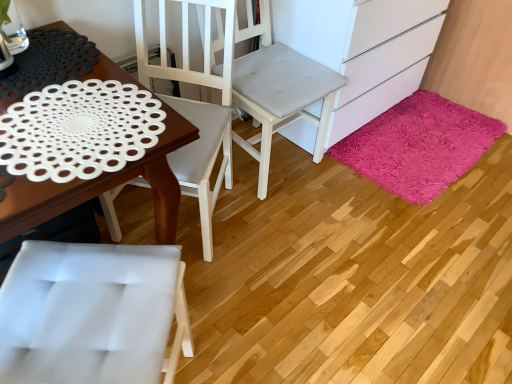
Where is `white matte cabinet at lower right`? The width and height of the screenshot is (512, 384). white matte cabinet at lower right is located at coordinates tap(362, 49).

You are a GUI agent. You are given a task and a screenshot of the screen. Output one action in this format:
    pyautogui.click(x=<x>, y=<y>)
    Task: Click on the white fabric chair at center, the second chair when ordered from left to right
    
    Given the screenshot: What is the action you would take?
    pyautogui.click(x=278, y=90)

Image resolution: width=512 pixels, height=384 pixels. What do you see at coordinates (103, 188) in the screenshot?
I see `white matte doily at left` at bounding box center [103, 188].

Where is `white matte chair at center, placed as the 2th chair when sorted from right to left`? white matte chair at center, placed as the 2th chair when sorted from right to left is located at coordinates (196, 107).

Locate an element on the screen. white matte cabinet at lower right is located at coordinates (362, 49).

Considering the relative sizes of white matte cabinet at lower right and white fabric chair at center, which is the first chair in right-to-left order, in the image provided, is white matte cabinet at lower right wider than white fabric chair at center, which is the first chair in right-to-left order,?

Indeed, white matte cabinet at lower right has a greater width compared to white fabric chair at center, which is the first chair in right-to-left order.

From the image's perspective, would you say white matte cabinet at lower right is positioned over white fabric chair at center, which is the first chair in right-to-left order?

Yes, from the image's perspective, white matte cabinet at lower right is on top of white fabric chair at center, which is the first chair in right-to-left order.

Based on the photo, is white fabric chair at center, which is the first chair in right-to-left order, at the back of white matte cabinet at lower right?

No, white fabric chair at center, which is the first chair in right-to-left order, is not at the back of white matte cabinet at lower right.

Considering the positions of point (339, 49) and point (243, 67), is point (339, 49) closer or farther from the camera than point (243, 67)?

Point (339, 49).

From the image's perspective, is white fabric chair at center, the second chair when ordered from left to right, on white matte cabinet at lower right?

Incorrect, from the image's perspective, white fabric chair at center, the second chair when ordered from left to right, is lower than white matte cabinet at lower right.

Based on their sizes in the image, would you say white fabric chair at center, which is the first chair in right-to-left order, is bigger or smaller than white matte cabinet at lower right?

Clearly, white fabric chair at center, which is the first chair in right-to-left order, is smaller in size than white matte cabinet at lower right.

Is white fabric chair at center, the second chair when ordered from left to right, inside or outside of white matte cabinet at lower right?

white fabric chair at center, the second chair when ordered from left to right, exists outside the volume of white matte cabinet at lower right.

Is white fabric chair at center, the second chair when ordered from left to right, beside white matte cabinet at lower right?

white fabric chair at center, the second chair when ordered from left to right, is not next to white matte cabinet at lower right, and they're not touching.

Considering their positions, is white matte cabinet at lower right located in front of or behind shaggy pink rug at lower right?

white matte cabinet at lower right is in front of shaggy pink rug at lower right.

Does white matte cabinet at lower right touch shaggy pink rug at lower right?

They are not placed beside each other.

Looking at this image, from the image's perspective, between white matte cabinet at lower right and shaggy pink rug at lower right, who is located below?

shaggy pink rug at lower right.

From a real-world perspective, is white matte cabinet at lower right located beneath shaggy pink rug at lower right?

No.

Is white fabric chair at center, which is the first chair in right-to-left order, situated inside shaggy pink rug at lower right or outside?

white fabric chair at center, which is the first chair in right-to-left order, is spatially situated outside shaggy pink rug at lower right.

Does white fabric chair at center, which is the first chair in right-to-left order, turn towards shaggy pink rug at lower right?

No, white fabric chair at center, which is the first chair in right-to-left order, is not turned towards shaggy pink rug at lower right.

Considering the sizes of objects white fabric chair at center, which is the first chair in right-to-left order, and shaggy pink rug at lower right in the image provided, who is bigger, white fabric chair at center, which is the first chair in right-to-left order, or shaggy pink rug at lower right?

white fabric chair at center, which is the first chair in right-to-left order, is bigger.

Between white fabric chair at center, the second chair when ordered from left to right, and shaggy pink rug at lower right, which one has more height?

white fabric chair at center, the second chair when ordered from left to right.

Locate an element on the screen. This screenshot has height=384, width=512. chair directly beneath the white matte chair at center, acting as the 1th chair starting from the left (from a real-world perspective) is located at coordinates (278, 90).

In the scene shown: Between white fabric chair at center, the second chair when ordered from left to right, and white matte chair at center, acting as the 1th chair starting from the left, which one has smaller width?

With smaller width is white fabric chair at center, the second chair when ordered from left to right.

Looking at this image, is white fabric chair at center, which is the first chair in right-to-left order, far away from white matte chair at center, placed as the 2th chair when sorted from right to left?

white fabric chair at center, which is the first chair in right-to-left order, is actually quite close to white matte chair at center, placed as the 2th chair when sorted from right to left.

Visually, is white matte chair at center, acting as the 1th chair starting from the left, positioned to the left or to the right of white fabric chair at center, the second chair when ordered from left to right?

white matte chair at center, acting as the 1th chair starting from the left, is positioned on white fabric chair at center, the second chair when ordered from left to right,'s left side.

From the image's perspective, is white matte chair at center, placed as the 2th chair when sorted from right to left, positioned above or below white fabric chair at center, the second chair when ordered from left to right?

Clearly, from the image's perspective, white matte chair at center, placed as the 2th chair when sorted from right to left, is below white fabric chair at center, the second chair when ordered from left to right.

Identify the location of chair behind the white matte chair at center, acting as the 1th chair starting from the left. (278, 90).

From a real-world perspective, who is located higher, white matte chair at center, placed as the 2th chair when sorted from right to left, or white fabric chair at center, which is the first chair in right-to-left order?

white matte chair at center, placed as the 2th chair when sorted from right to left, is physically above.

From the image's perspective, does white matte cabinet at lower right appear lower than white matte doily at left?

Incorrect, from the image's perspective, white matte cabinet at lower right is higher than white matte doily at left.

Between white matte cabinet at lower right and white matte doily at left, which one is positioned in front?

white matte doily at left is in front.

Looking at this image, how far apart are white matte cabinet at lower right and white matte doily at left?

white matte cabinet at lower right is 1.12 meters from white matte doily at left.

Does white matte cabinet at lower right have a larger size compared to white matte doily at left?

Yes.

The image size is (512, 384). I want to click on the 1st chair directly above the white matte cabinet at lower right (from a real-world perspective), so click(278, 90).

Locate an element on the screen. The width and height of the screenshot is (512, 384). the 1st chair to the left when counting from the white matte cabinet at lower right is located at coordinates (278, 90).

From the image, which object appears to be farther from shaggy pink rug at lower right, white matte doily at left or white fabric chair at center, which is the first chair in right-to-left order?

The object further to shaggy pink rug at lower right is white matte doily at left.

Based on their spatial positions, is white matte doily at left or white matte cabinet at lower right further from white matte chair at center, placed as the 2th chair when sorted from right to left?

Based on the image, white matte cabinet at lower right appears to be further to white matte chair at center, placed as the 2th chair when sorted from right to left.

Considering their positions, is white matte chair at center, acting as the 1th chair starting from the left, positioned further to white fabric chair at center, which is the first chair in right-to-left order, than white matte doily at left?

white matte doily at left is further to white fabric chair at center, which is the first chair in right-to-left order.

When comparing their distances from white matte doily at left, does white matte cabinet at lower right or white matte chair at center, placed as the 2th chair when sorted from right to left, seem further?

Based on the image, white matte cabinet at lower right appears to be further to white matte doily at left.

Looking at the image, which one is located further to white matte cabinet at lower right, shaggy pink rug at lower right or white matte chair at center, placed as the 2th chair when sorted from right to left?

white matte chair at center, placed as the 2th chair when sorted from right to left, is further to white matte cabinet at lower right.

When comparing their distances from shaggy pink rug at lower right, does white matte doily at left or white matte chair at center, placed as the 2th chair when sorted from right to left, seem further?

white matte doily at left lies further to shaggy pink rug at lower right than the other object.

From the image, which object appears to be farther from white matte chair at center, placed as the 2th chair when sorted from right to left, white matte cabinet at lower right or white matte doily at left?

Based on the image, white matte cabinet at lower right appears to be further to white matte chair at center, placed as the 2th chair when sorted from right to left.

When comparing their distances from white fabric chair at center, which is the first chair in right-to-left order, does white matte doily at left or white matte cabinet at lower right seem closer?

The object closer to white fabric chair at center, which is the first chair in right-to-left order, is white matte cabinet at lower right.

What are the coordinates of `cabinetry situated between white matte chair at center, acting as the 1th chair starting from the left, and shaggy pink rug at lower right from left to right` in the screenshot? It's located at (362, 49).

This screenshot has height=384, width=512. In order to click on chair located between white matte doily at left and white fabric chair at center, the second chair when ordered from left to right, in the left-right direction in this screenshot , I will do `click(196, 107)`.

Find the location of `chair located between white matte chair at center, acting as the 1th chair starting from the left, and shaggy pink rug at lower right in the left-right direction`. chair located between white matte chair at center, acting as the 1th chair starting from the left, and shaggy pink rug at lower right in the left-right direction is located at coordinates (278, 90).

Where is `chair located between white matte chair at center, acting as the 1th chair starting from the left, and white matte cabinet at lower right in the left-right direction`? chair located between white matte chair at center, acting as the 1th chair starting from the left, and white matte cabinet at lower right in the left-right direction is located at coordinates (278, 90).